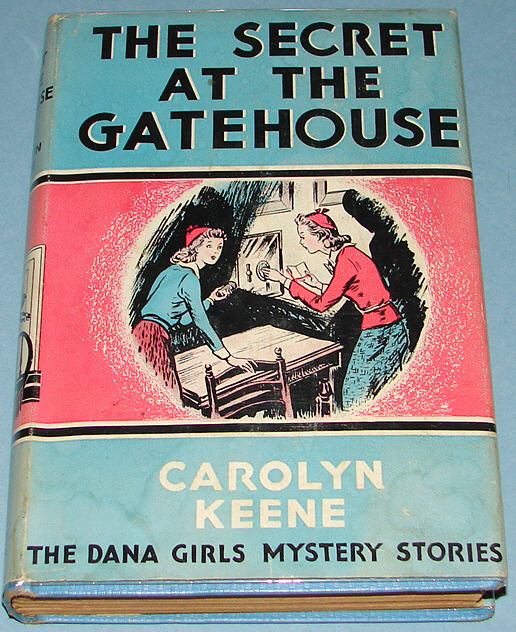
At what (x,y) coordinates should I click in order to perform the action: click on wall safe. Please return your answer as a coordinate pair (x, y). The image size is (516, 632). Looking at the image, I should click on (256, 260).